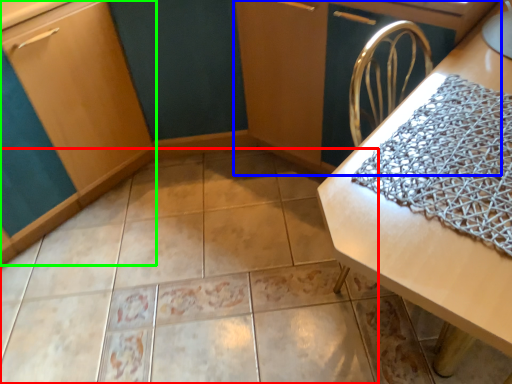
Question: Based on their relative distances, which object is nearer to ceramic tile (highlighted by a red box)? Choose from dresser (highlighted by a blue box) and cabinetry (highlighted by a green box).

Choices:
 (A) dresser
 (B) cabinetry

Answer: (B)